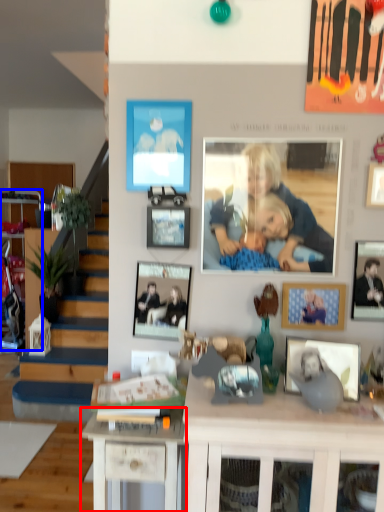
Question: Which point is further to the camera, desk (highlighted by a red box) or cabinetry (highlighted by a blue box)?

Choices:
 (A) desk
 (B) cabinetry

Answer: (B)